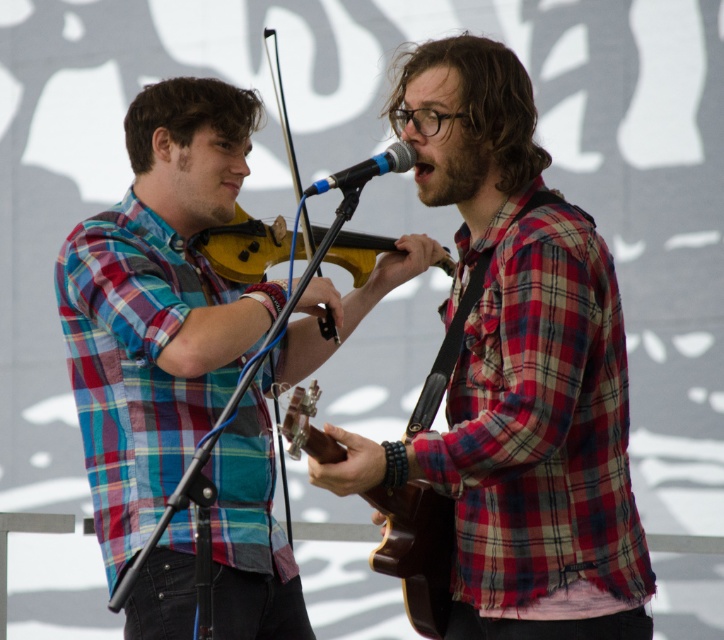
Is point (143, 381) more distant than point (362, 182)?

Yes, point (143, 381) is farther from viewer.

Can you confirm if plaid shirt violinist at center is positioned to the left of blue metallic microphone at center?

Yes, plaid shirt violinist at center is to the left of blue metallic microphone at center.

Image resolution: width=724 pixels, height=640 pixels. Describe the element at coordinates (159, 305) in the screenshot. I see `plaid shirt violinist at center` at that location.

Locate an element on the screen. plaid shirt violinist at center is located at coordinates (159, 305).

Consider the image. Who is taller, plaid shirt violinist at center or wooden violin at center?

Standing taller between the two is plaid shirt violinist at center.

Is point (153, 218) more distant than point (243, 278)?

No, it is in front of (243, 278).

Measure the distance between point (159,227) and camera.

Point (159,227) and camera are 3.91 meters apart from each other.

Where is `plaid shirt violinist at center`? The width and height of the screenshot is (724, 640). plaid shirt violinist at center is located at coordinates (159, 305).

Where is `brown wooden violin at center`? The height and width of the screenshot is (640, 724). brown wooden violin at center is located at coordinates (416, 552).

How far apart are brown wooden violin at center and blue metallic microphone at center?

A distance of 18.55 inches exists between brown wooden violin at center and blue metallic microphone at center.

Who is more forward, [424,624] or [411,152]?

Point [411,152]

Identify the location of brown wooden violin at center. (416, 552).